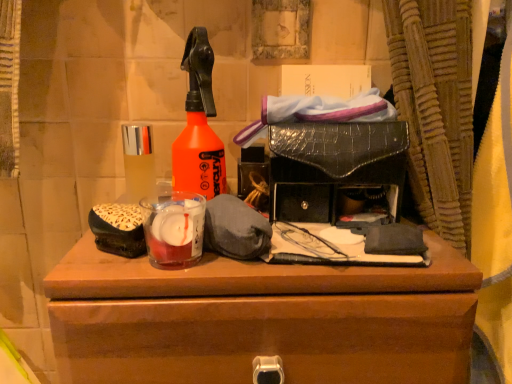
Find the location of a particular element. This screenshot has width=512, height=384. blank space situated above brown wooden chest of drawers at center (from a real-world perspective) is located at coordinates (265, 256).